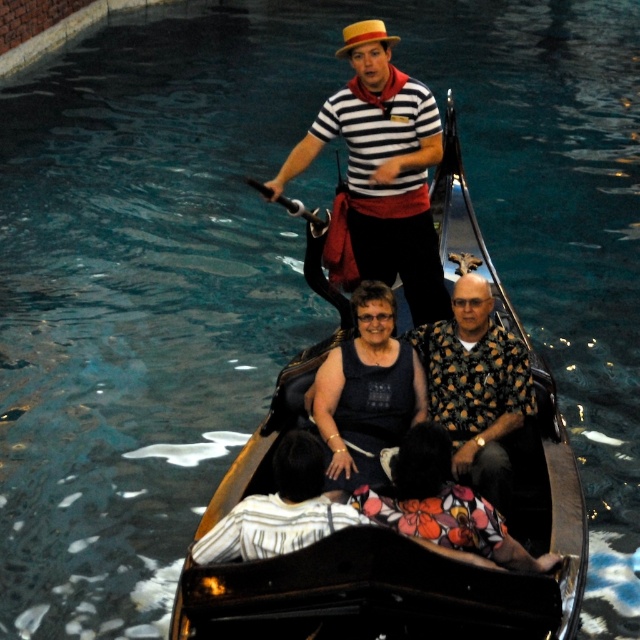
You are a photographer taking a picture of the black polished wood canoe at center and the floral fabric dress at center. Which object should you focus on first to ensure it appears sharp in the photo?

The black polished wood canoe at center is above the floral fabric dress at center, so you should focus on the black polished wood canoe at center first to ensure it appears sharp in the photo.